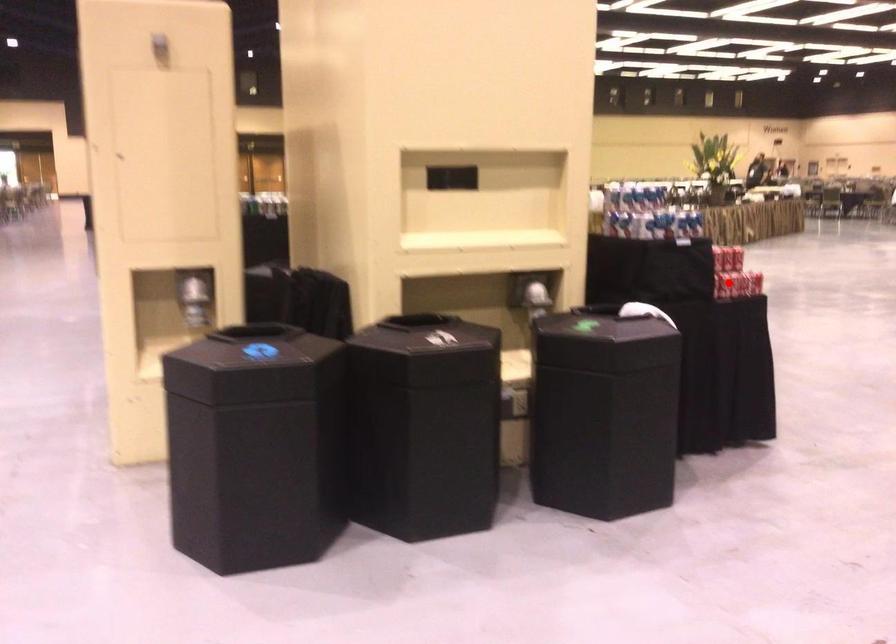
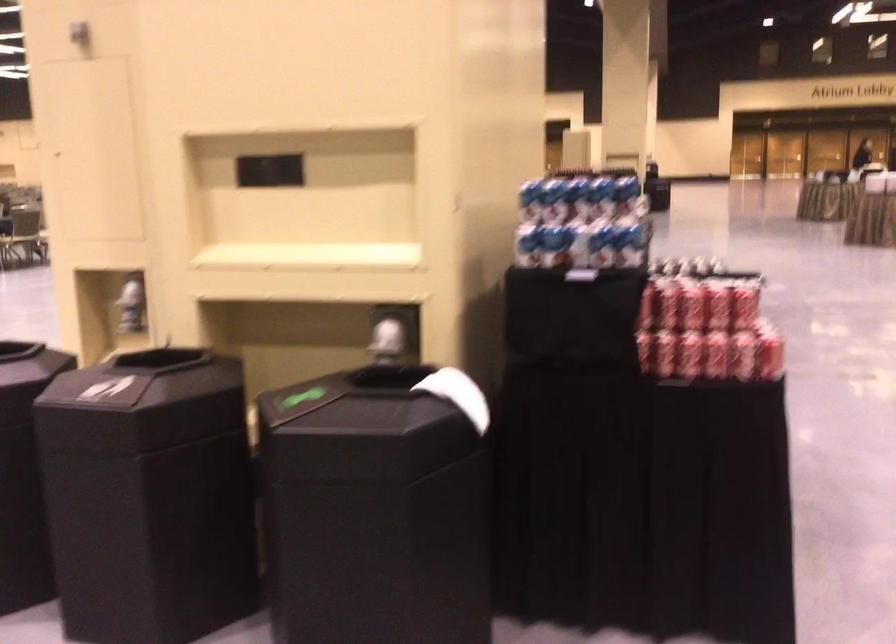
Find the pixel in the second image that matches the highlighted location in the first image.

(664, 353)